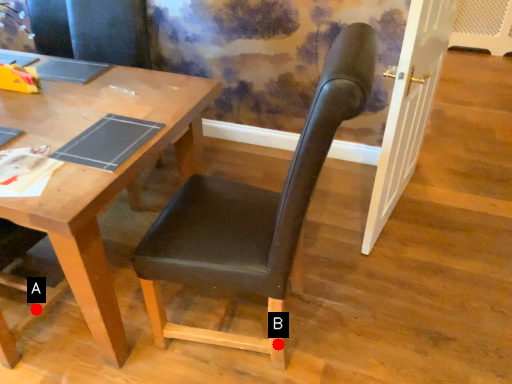
Question: Two points are circled on the image, labeled by A and B beside each circle. Which point is closer to the camera?

Choices:
 (A) A is closer
 (B) B is closer

Answer: (B)